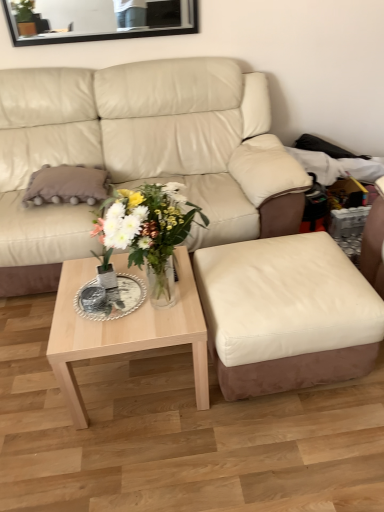
At what (x,y) coordinates should I click in order to perform the action: click on free space above light wood/texture coffee table at center (from a real-world perspective). Please return your answer as a coordinate pair (x, y). Looking at the image, I should click on (132, 298).